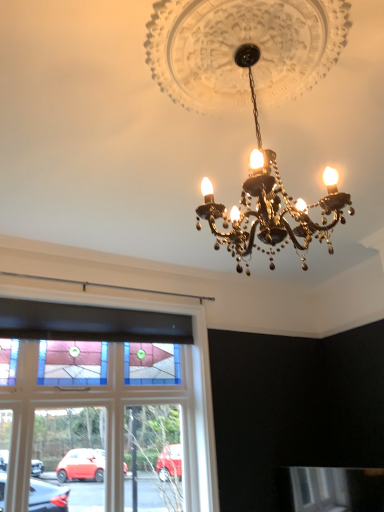
In order to face stained glass window at center, should I rotate leftwards or rightwards?

You should rotate left by 9.936 degrees.

What are the coordinates of `stained glass window at center` in the screenshot? It's located at (118, 402).

This screenshot has width=384, height=512. What do you see at coordinates (118, 402) in the screenshot?
I see `stained glass window at center` at bounding box center [118, 402].

Measure the distance between point (x=197, y=497) and camera.

They are 3.49 meters apart.

Describe the element at coordinates (248, 92) in the screenshot. This screenshot has height=512, width=384. I see `gold metallic chandelier at center` at that location.

This screenshot has height=512, width=384. I want to click on gold metallic chandelier at center, so click(x=248, y=92).

In order to face gold metallic chandelier at center, should I rotate leftwards or rightwards?

A 9.070 degree turn to the right will do.

I want to click on stained glass window at center, so click(x=118, y=402).

Can you confirm if gold metallic chandelier at center is positioned to the right of stained glass window at center?

Yes, gold metallic chandelier at center is to the right of stained glass window at center.

Is gold metallic chandelier at center in front of or behind stained glass window at center in the image?

gold metallic chandelier at center is in front of stained glass window at center.

Is point (247, 237) closer or farther from the camera than point (203, 501)?

Point (247, 237) appears to be closer to the viewer than point (203, 501).

From the image's perspective, which one is positioned higher, gold metallic chandelier at center or stained glass window at center?

gold metallic chandelier at center, from the image's perspective.

From a real-world perspective, which is physically above, gold metallic chandelier at center or stained glass window at center?

In real-world perspective, gold metallic chandelier at center is above.

From the picture: Between gold metallic chandelier at center and stained glass window at center, which one has larger width?

gold metallic chandelier at center.

Consider the image. Between gold metallic chandelier at center and stained glass window at center, which one has less height?

gold metallic chandelier at center.

Looking at the image, does gold metallic chandelier at center seem bigger or smaller compared to stained glass window at center?

Clearly, gold metallic chandelier at center is larger in size than stained glass window at center.

Based on the photo, is stained glass window at center a part of gold metallic chandelier at center?

Actually, stained glass window at center is outside gold metallic chandelier at center.

Are gold metallic chandelier at center and stained glass window at center far apart?

Indeed, gold metallic chandelier at center is not near stained glass window at center.

Could you tell me if gold metallic chandelier at center is turned towards stained glass window at center?

No, gold metallic chandelier at center is not aimed at stained glass window at center.

Can you tell me how much gold metallic chandelier at center and stained glass window at center differ in facing direction?

They differ by 88.6 degrees in their facing directions.

At what (x,y) coordinates should I click in order to perform the action: click on window directly beneath the gold metallic chandelier at center (from a real-world perspective). Please return your answer as a coordinate pair (x, y). The height and width of the screenshot is (512, 384). Looking at the image, I should click on (118, 402).

Is stained glass window at center at the left side of gold metallic chandelier at center?

Correct, you'll find stained glass window at center to the left of gold metallic chandelier at center.

From the picture: Is stained glass window at center further to camera compared to gold metallic chandelier at center?

Yes, the depth of stained glass window at center is greater than that of gold metallic chandelier at center.

Considering the positions of point (200, 489) and point (182, 30), is point (200, 489) closer or farther from the camera than point (182, 30)?

Point (200, 489) appears to be farther away from the viewer than point (182, 30).

From the image's perspective, is stained glass window at center positioned above or below gold metallic chandelier at center?

Clearly, from the image's perspective, stained glass window at center is below gold metallic chandelier at center.

From a real-world perspective, who is located higher, stained glass window at center or gold metallic chandelier at center?

gold metallic chandelier at center.

Considering the sizes of objects stained glass window at center and gold metallic chandelier at center in the image provided, who is wider, stained glass window at center or gold metallic chandelier at center?

gold metallic chandelier at center is wider.

Who is shorter, stained glass window at center or gold metallic chandelier at center?

gold metallic chandelier at center is shorter.

Is stained glass window at center smaller than gold metallic chandelier at center?

Correct, stained glass window at center occupies less space than gold metallic chandelier at center.

Is stained glass window at center surrounding gold metallic chandelier at center?

No, gold metallic chandelier at center is located outside of stained glass window at center.

Is stained glass window at center in contact with gold metallic chandelier at center?

They are not placed beside each other.

Does stained glass window at center turn towards gold metallic chandelier at center?

Yes, stained glass window at center is oriented towards gold metallic chandelier at center.

What are the coordinates of `lamp on the right of stained glass window at center` in the screenshot? It's located at (248, 92).

Find the location of `window located behind the gold metallic chandelier at center`. window located behind the gold metallic chandelier at center is located at coordinates (118, 402).

Where is `lamp in front of the stained glass window at center`? Image resolution: width=384 pixels, height=512 pixels. lamp in front of the stained glass window at center is located at coordinates (248, 92).